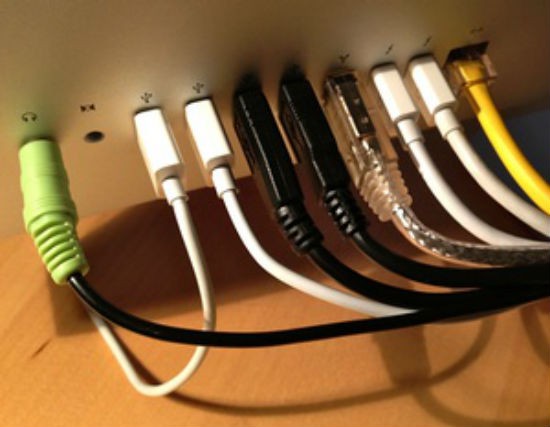
Locate an element on the screen. This screenshot has width=550, height=427. cables is located at coordinates (51, 196), (163, 168), (212, 159), (262, 157), (311, 150), (356, 133), (406, 109), (437, 94), (480, 79).